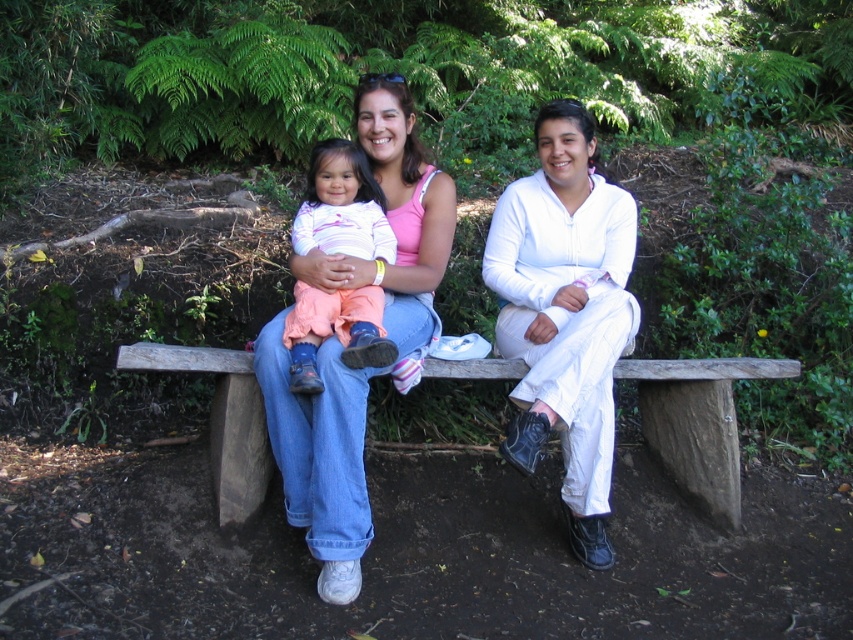
Between wooden bench at center and matte pink shirt at center, which one appears on the right side from the viewer's perspective?

Positioned to the right is wooden bench at center.

Can you confirm if wooden bench at center is smaller than matte pink shirt at center?

Incorrect, wooden bench at center is not smaller in size than matte pink shirt at center.

Is point (718, 481) positioned in front of point (322, 332)?

No.

You are a GUI agent. You are given a task and a screenshot of the screen. Output one action in this format:
    pyautogui.click(x=<x>, y=<y>)
    Task: Click on the wooden bench at center
    
    Given the screenshot: What is the action you would take?
    pyautogui.click(x=698, y=422)

Who is positioned more to the right, matte pink tank top at center or wooden bench at center?

From the viewer's perspective, wooden bench at center appears more on the right side.

Where is `matte pink tank top at center`? Image resolution: width=853 pixels, height=640 pixels. matte pink tank top at center is located at coordinates (320, 458).

Is point (325, 372) closer to camera compared to point (264, 444)?

Yes.

You are a GUI agent. You are given a task and a screenshot of the screen. Output one action in this format:
    pyautogui.click(x=<x>, y=<y>)
    Task: Click on the matte pink tank top at center
    The width and height of the screenshot is (853, 640).
    Given the screenshot: What is the action you would take?
    pyautogui.click(x=320, y=458)

Is white matte pants at center wider than matte pink tank top at center?

In fact, white matte pants at center might be narrower than matte pink tank top at center.

Can you confirm if white matte pants at center is smaller than matte pink tank top at center?

Yes.

This screenshot has height=640, width=853. What are the coordinates of `white matte pants at center` in the screenshot? It's located at (566, 312).